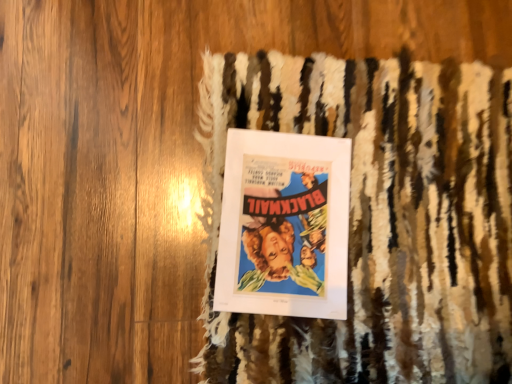
The image size is (512, 384). Identify the location of empty space that is ontop of vibrant paper poster at center. point(280,221).